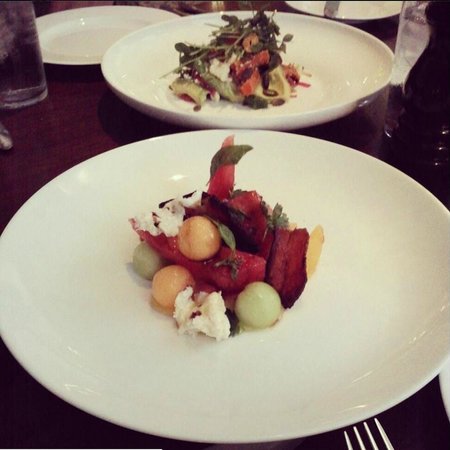
Find the location of a particular element. The image size is (450, 450). water glass is located at coordinates (17, 55).